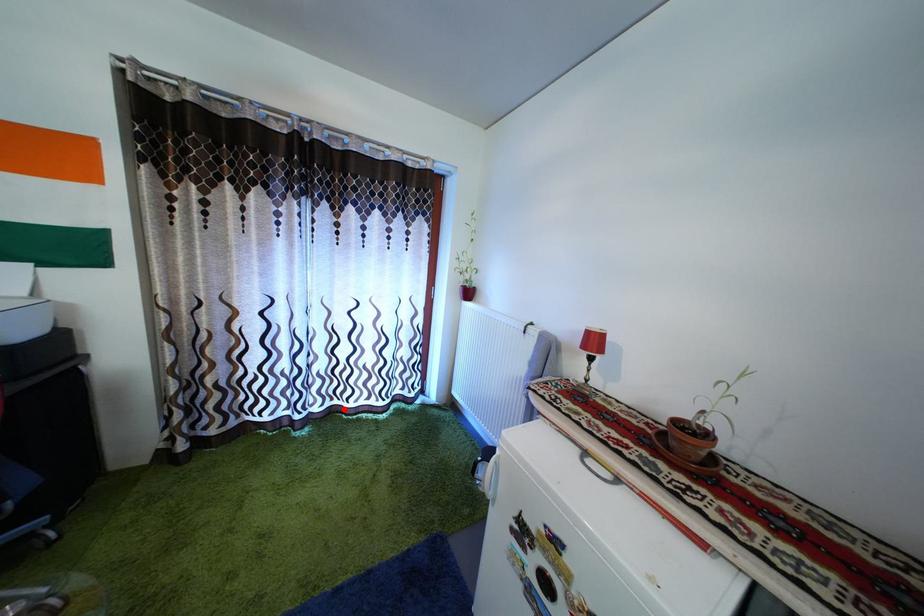
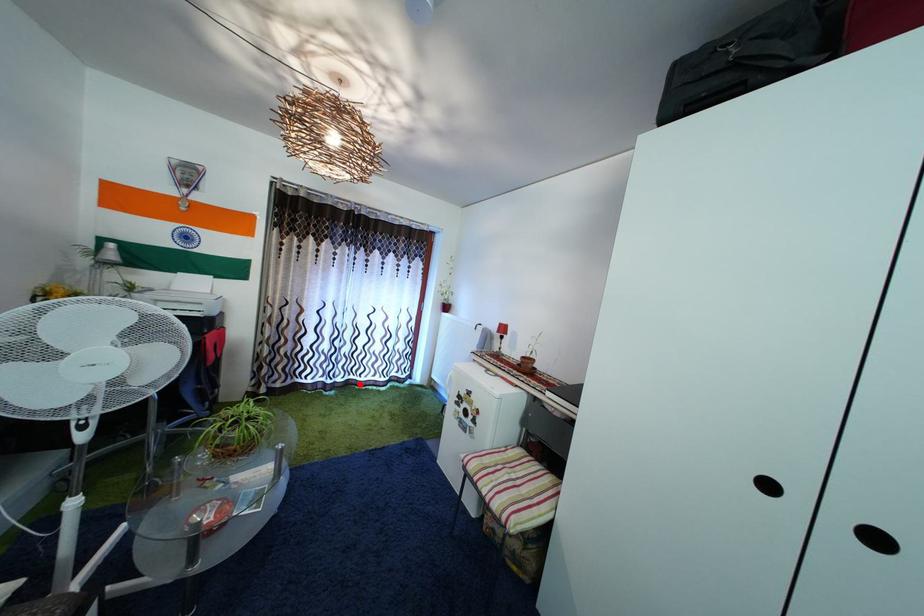
I am providing you with two images of the same scene from different viewpoints. A red point is marked on the first image and another point is marked on the second image. Is the red point in image1 aligned with the point shown in image2?

Yes